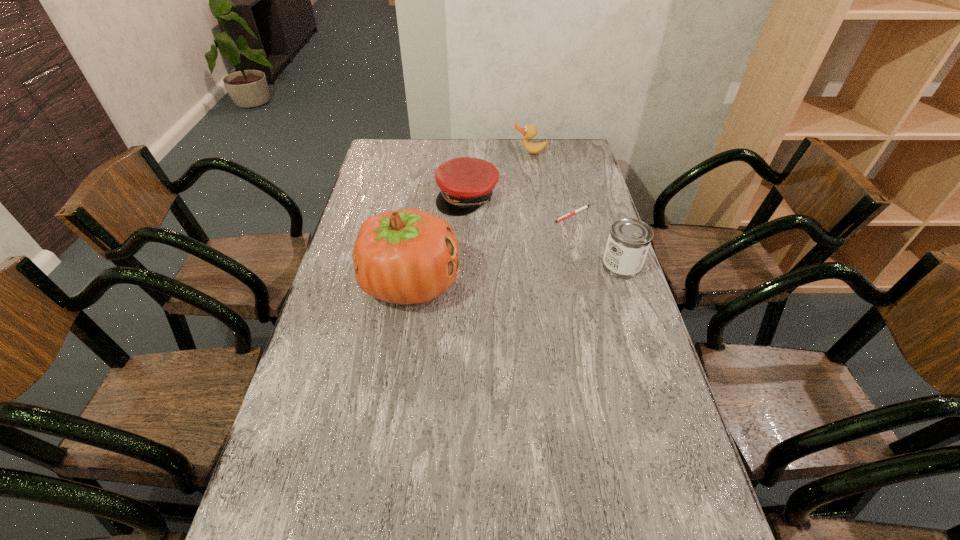
The height and width of the screenshot is (540, 960). Find the location of `vacant space at the far edge`. vacant space at the far edge is located at coordinates (516, 141).

Find the location of `vacant space at the near edge`. vacant space at the near edge is located at coordinates (470, 507).

In the image, there is a desktop. At what (x,y) coordinates should I click in order to perform the action: click on free space at the left edge. Please return your answer as a coordinate pair (x, y). Looking at the image, I should click on (335, 289).

Where is `vacant space at the right edge of the desktop`? This screenshot has height=540, width=960. vacant space at the right edge of the desktop is located at coordinates pos(631,284).

In the image, there is a desktop. In order to click on vacant space at the far right corner in this screenshot , I will do `click(568, 150)`.

The height and width of the screenshot is (540, 960). In order to click on free spot between the can and the shortest object in this screenshot , I will do `click(597, 240)`.

Locate an element on the screen. vacant area between the pumpkin and the farthest object is located at coordinates (470, 218).

Where is `empty space that is in between the can and the farthest object`? empty space that is in between the can and the farthest object is located at coordinates (575, 209).

Locate an element on the screen. The width and height of the screenshot is (960, 540). free space that is in between the can and the tallest object is located at coordinates (516, 274).

Locate an element on the screen. vacant space that is in between the duck and the can is located at coordinates (575, 209).